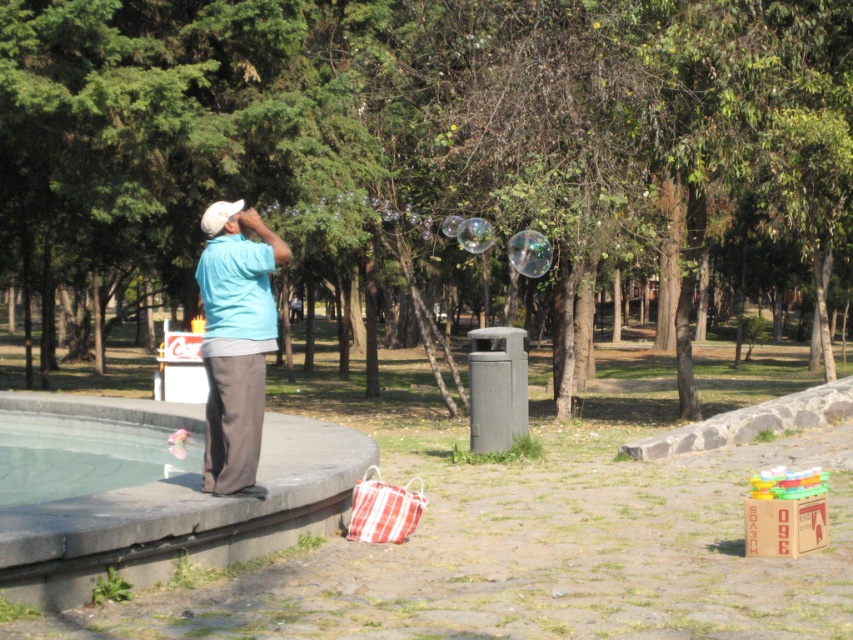
Question: Which point is farther from the camera taking this photo?

Choices:
 (A) (62, 481)
 (B) (241, 230)

Answer: (A)

Question: Is matte blue shirt at center wider than transparent glass pool at lower left?

Choices:
 (A) no
 (B) yes

Answer: (A)

Question: Does matte blue shirt at center have a lesser width compared to transparent glass pool at lower left?

Choices:
 (A) no
 (B) yes

Answer: (B)

Question: Among these points, which one is nearest to the camera?

Choices:
 (A) (135, 465)
 (B) (244, 483)

Answer: (B)

Question: Does matte blue shirt at center have a lesser width compared to transparent glass pool at lower left?

Choices:
 (A) no
 (B) yes

Answer: (B)

Question: Which point is farther from the camera taking this photo?

Choices:
 (A) (35, 468)
 (B) (262, 360)

Answer: (A)